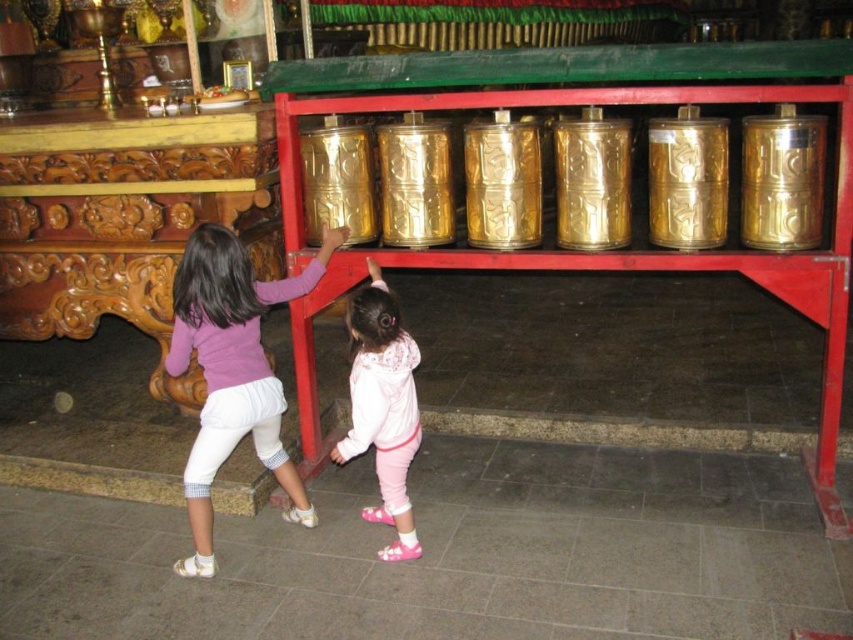
Is purple cotton shirt at lower left bigger than pink fleece jacket at center?

Indeed, purple cotton shirt at lower left has a larger size compared to pink fleece jacket at center.

Can you confirm if purple cotton shirt at lower left is shorter than pink fleece jacket at center?

No.

I want to click on purple cotton shirt at lower left, so click(231, 371).